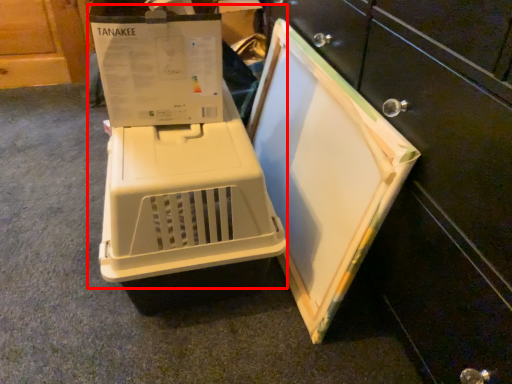
Question: Where is appliance (annotated by the red box) located in relation to home appliance in the image?

Choices:
 (A) left
 (B) right

Answer: (A)